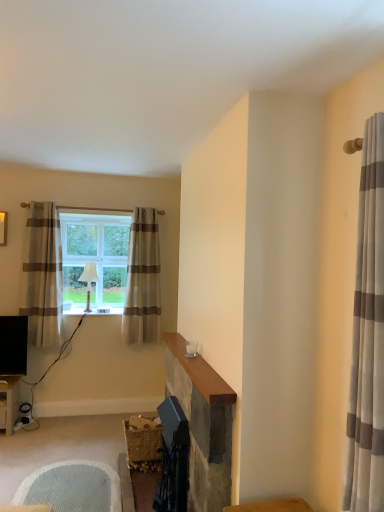
Question: Is beige striped curtain at center, positioned as the 2th curtain in right-to-left order, next to white fabric lampshade at window?

Choices:
 (A) yes
 (B) no

Answer: (B)

Question: Can you confirm if beige striped curtain at center, the second curtain positioned from the left, is positioned to the right of white fabric lampshade at window?

Choices:
 (A) no
 (B) yes

Answer: (B)

Question: From the image's perspective, is beige striped curtain at center, which ranks as the 3th curtain in front-to-back order, located above white fabric lampshade at window?

Choices:
 (A) yes
 (B) no

Answer: (A)

Question: Does beige striped curtain at center, which ranks as the first curtain in back-to-front order, appear on the left side of white fabric lampshade at window?

Choices:
 (A) yes
 (B) no

Answer: (B)

Question: Does beige striped curtain at center, the second curtain positioned from the left, have a lesser height compared to white fabric lampshade at window?

Choices:
 (A) yes
 (B) no

Answer: (B)

Question: From the image's perspective, is smooth stone fireplace at center positioned above or below white textured rug at lower left?

Choices:
 (A) above
 (B) below

Answer: (A)

Question: Is smooth stone fireplace at center spatially inside white textured rug at lower left, or outside of it?

Choices:
 (A) outside
 (B) inside

Answer: (A)

Question: In terms of size, does smooth stone fireplace at center appear bigger or smaller than white textured rug at lower left?

Choices:
 (A) small
 (B) big

Answer: (B)

Question: Considering the positions of smooth stone fireplace at center and white textured rug at lower left in the image, is smooth stone fireplace at center taller or shorter than white textured rug at lower left?

Choices:
 (A) tall
 (B) short

Answer: (A)

Question: Relative to clear glass window at center, is beige striped curtain at left, arranged as the second curtain when viewed from the back, in front or behind?

Choices:
 (A) front
 (B) behind

Answer: (A)

Question: Is point (59, 309) closer or farther from the camera than point (64, 268)?

Choices:
 (A) closer
 (B) farther

Answer: (A)

Question: Would you say beige striped curtain at left, marked as the second curtain in a front-to-back arrangement, is inside or outside clear glass window at center?

Choices:
 (A) inside
 (B) outside

Answer: (B)

Question: Is beige striped curtain at left, the 1th curtain from the left, wider or thinner than clear glass window at center?

Choices:
 (A) wide
 (B) thin

Answer: (A)

Question: From the image's perspective, is white fabric lampshade at window positioned above or below white textured rug at lower left?

Choices:
 (A) above
 (B) below

Answer: (A)

Question: Considering the positions of point (87, 294) and point (89, 481), is point (87, 294) closer or farther from the camera than point (89, 481)?

Choices:
 (A) closer
 (B) farther

Answer: (B)